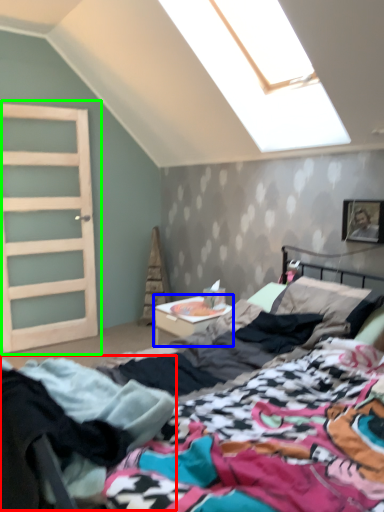
Question: Which object is positioned farthest from clothing (highlighted by a red box)? Select from nightstand (highlighted by a blue box) and door (highlighted by a green box).

Choices:
 (A) nightstand
 (B) door

Answer: (B)